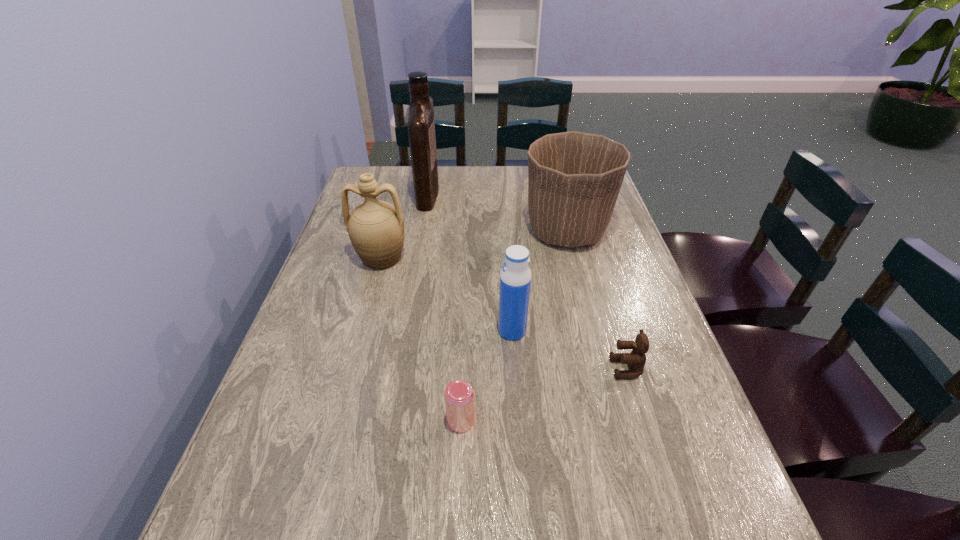
This screenshot has height=540, width=960. I want to click on the tallest object, so click(x=421, y=127).

Locate an element on the screen. flowerpot is located at coordinates (574, 179).

Where is `pitcher`? pitcher is located at coordinates point(376,228).

Where is `the fourth object from left to right`? the fourth object from left to right is located at coordinates (515, 278).

The height and width of the screenshot is (540, 960). What are the coordinates of `the fourth farthest object` in the screenshot? It's located at (515, 278).

You are a GUI agent. You are given a task and a screenshot of the screen. Output one action in this format:
    pyautogui.click(x=<x>, y=<y>)
    Task: Click on the teddy bear
    The width and height of the screenshot is (960, 540).
    Given the screenshot: What is the action you would take?
    pyautogui.click(x=636, y=359)

You are a GUI agent. You are given a task and a screenshot of the screen. Output one action in this format:
    pyautogui.click(x=<x>, y=<y>)
    Task: Click on the beer can
    Image resolution: width=960 pixels, height=540 pixels.
    Given the screenshot: What is the action you would take?
    pyautogui.click(x=459, y=395)

The image size is (960, 540). In order to click on the fourth object from right to left in this screenshot , I will do `click(459, 395)`.

The height and width of the screenshot is (540, 960). I want to click on free region located on the label side of the tallest object, so click(x=491, y=193).

Locate an element on the screen. The height and width of the screenshot is (540, 960). vacant space located 0.290m on the front of the flowerpot is located at coordinates (594, 340).